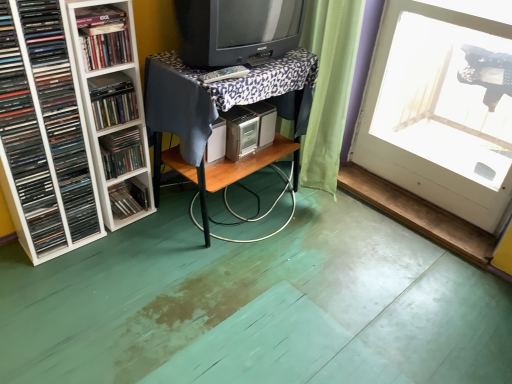
At what (x,y) coordinates should I click in order to perform the action: click on vacant space to the right of white plastic shelf at left. Please return your answer as a coordinate pair (x, y). The width and height of the screenshot is (512, 384). Looking at the image, I should click on 161,229.